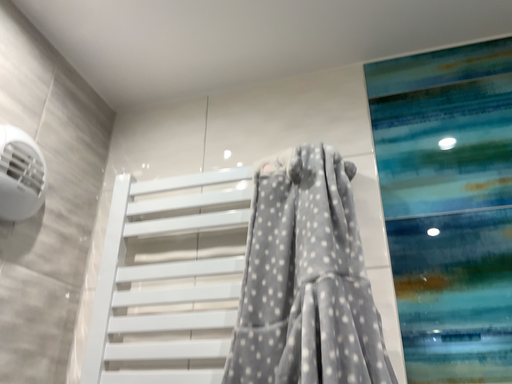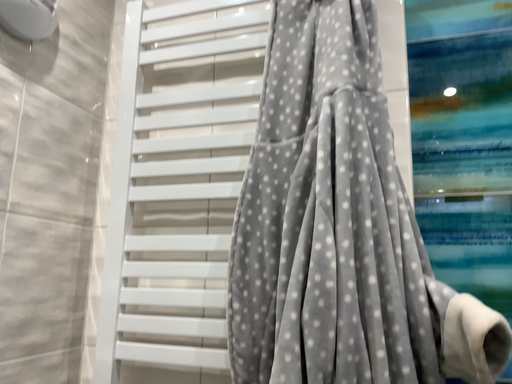
Question: How did the camera likely rotate when shooting the video?

Choices:
 (A) rotated downward
 (B) rotated upward

Answer: (A)